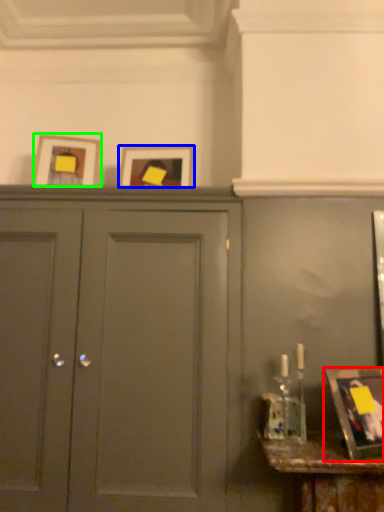
Question: Estimate the real-world distances between objects in this image. Which object is farther from picture frame (highlighted by a red box), picture frame (highlighted by a blue box) or picture frame (highlighted by a green box)?

Choices:
 (A) picture frame
 (B) picture frame

Answer: (B)